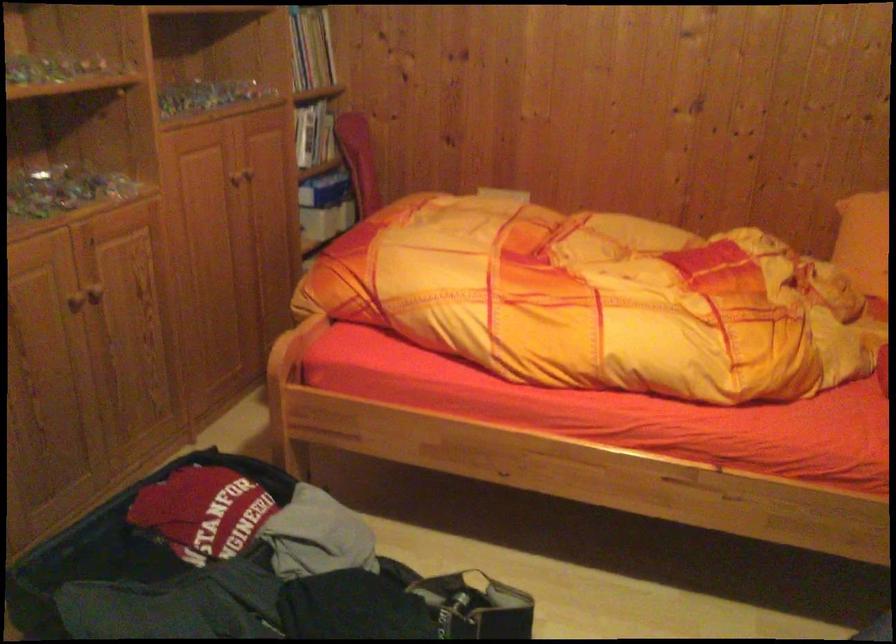
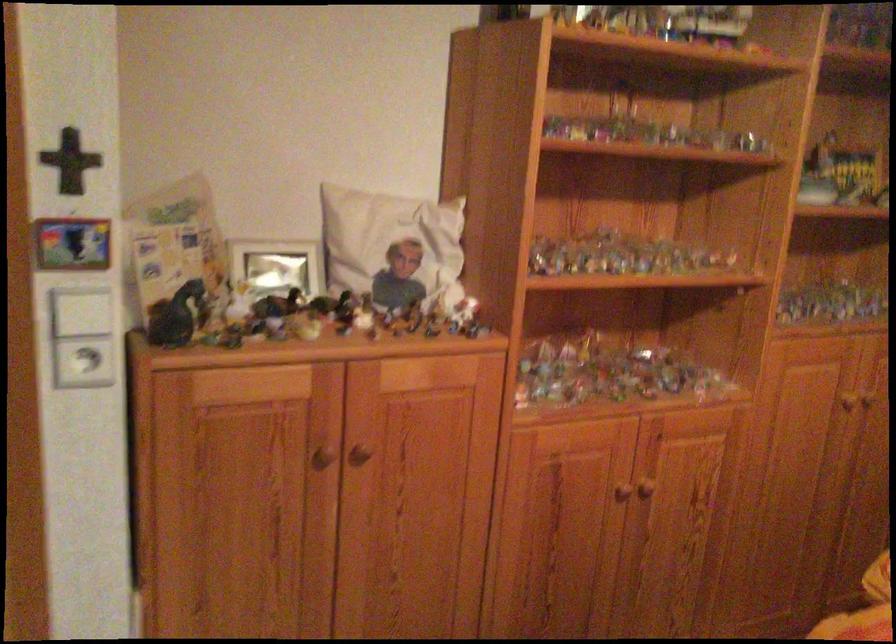
Question: The images are taken continuously from a first-person perspective. In which direction is your viewpoint rotating?

Choices:
 (A) Left
 (B) Right
 (C) Up
 (D) Down

Answer: (A)